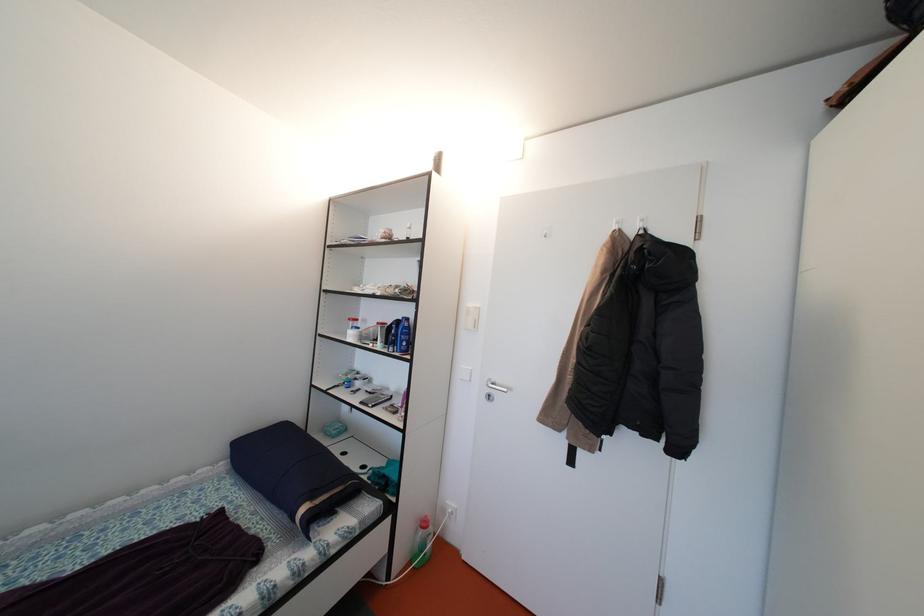
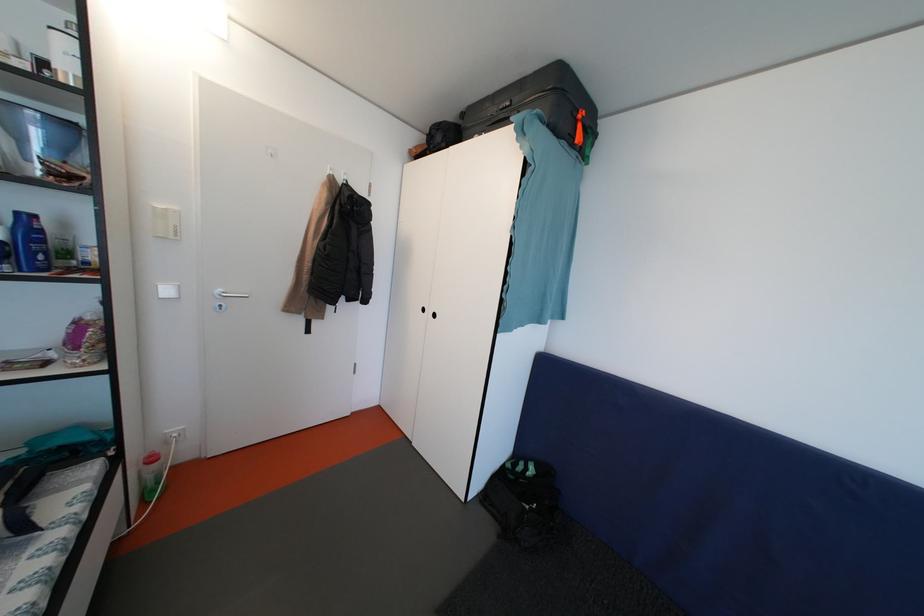
Find the pixel in the second image that matches point (411, 349) in the first image.

(49, 262)